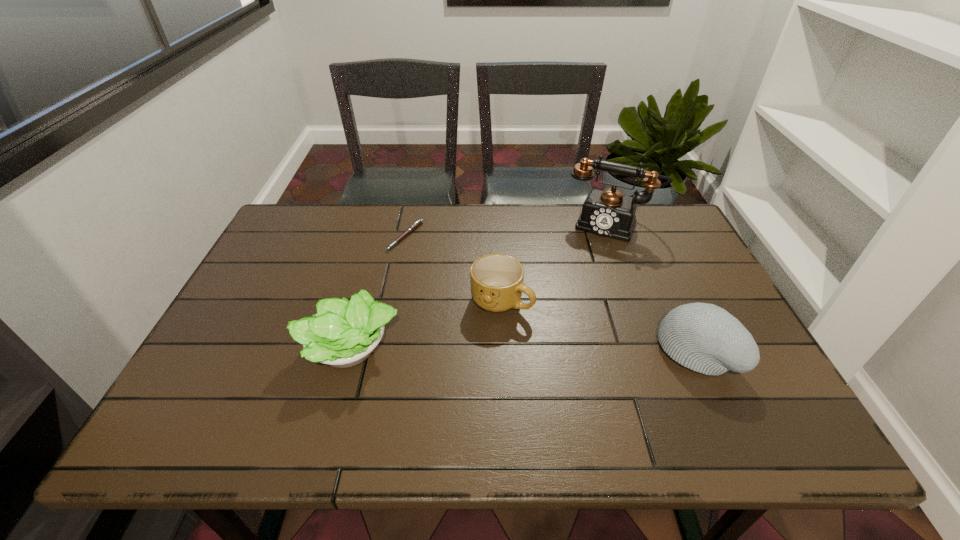
This screenshot has height=540, width=960. What are the coordinates of `blank region between the shortest object and the lettuce` in the screenshot? It's located at (378, 293).

What are the coordinates of `free area in between the pen and the mug` in the screenshot? It's located at (454, 268).

Find the location of a particular element. free space between the beanie and the lettuce is located at coordinates (523, 349).

Where is `vacant space that is in between the shortest object and the tallest object`? The height and width of the screenshot is (540, 960). vacant space that is in between the shortest object and the tallest object is located at coordinates (508, 231).

At what (x,y) coordinates should I click in order to perform the action: click on unoccupied position between the third object from left to right and the shortest object. Please return your answer as a coordinate pair (x, y). The image size is (960, 540). Looking at the image, I should click on (454, 268).

The height and width of the screenshot is (540, 960). What are the coordinates of `free space between the beanie and the shortest object` in the screenshot? It's located at (551, 293).

This screenshot has width=960, height=540. I want to click on free point between the lettuce and the beanie, so click(x=523, y=349).

Find the location of a particular element. Image resolution: width=960 pixels, height=540 pixels. free spot between the mug and the tallest object is located at coordinates (556, 263).

Where is `vacant region between the shortest object and the telephone`? vacant region between the shortest object and the telephone is located at coordinates (508, 231).

You are a GUI agent. You are given a task and a screenshot of the screen. Output one action in this format:
    pyautogui.click(x=<x>, y=<y>)
    Task: Click on the empty space that is in between the third object from right to left and the lettuce
    
    Given the screenshot: What is the action you would take?
    pyautogui.click(x=426, y=325)